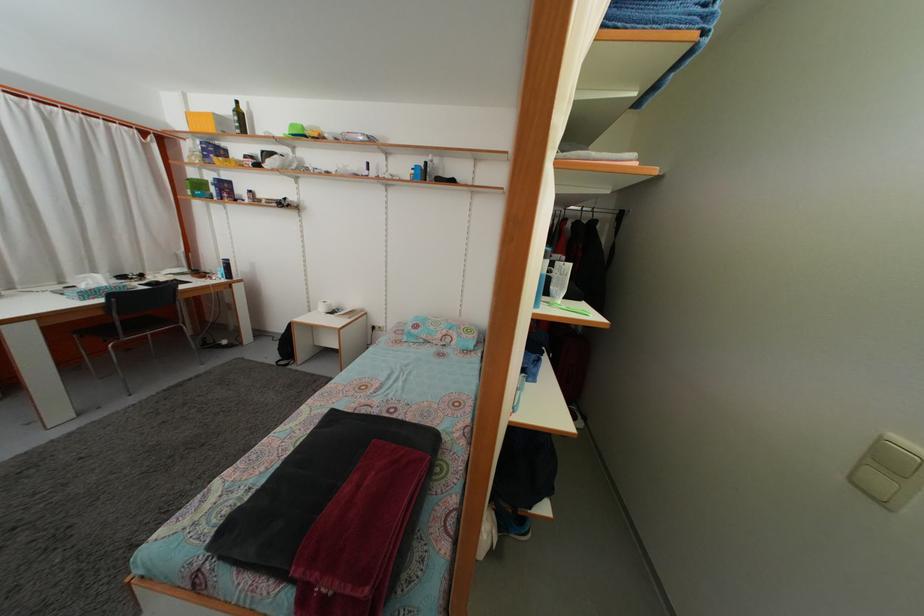
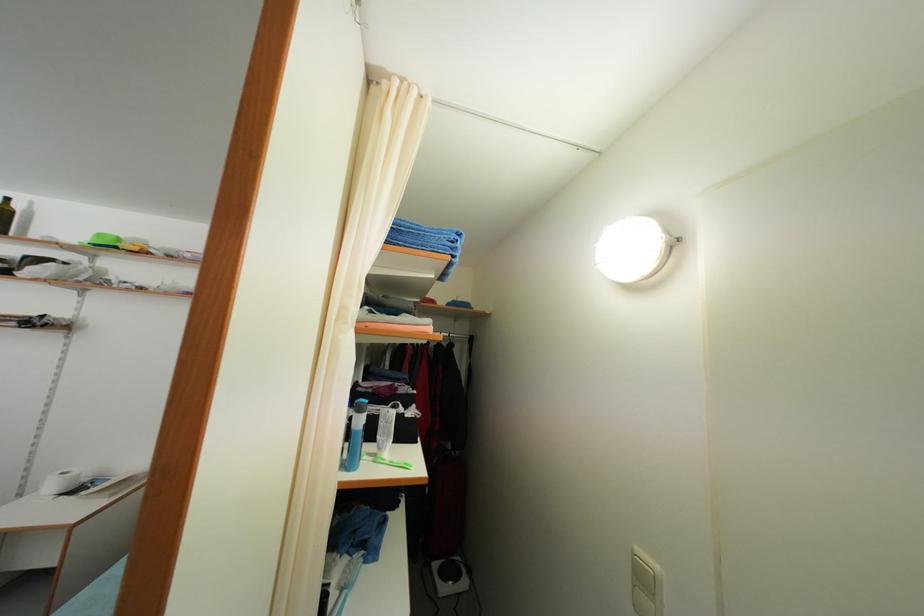
Find the pixel in the second image that matches point 327,315 in the first image.

(56, 493)